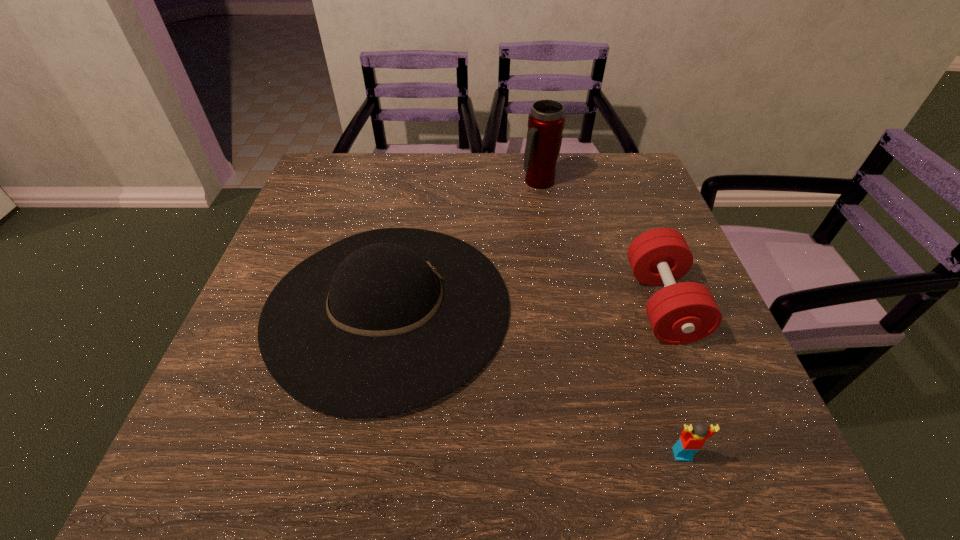
The height and width of the screenshot is (540, 960). I want to click on free location at the far right corner of the desktop, so click(x=623, y=158).

Where is `empty space between the second tallest object and the dumbbell`? The height and width of the screenshot is (540, 960). empty space between the second tallest object and the dumbbell is located at coordinates (525, 306).

The height and width of the screenshot is (540, 960). Identify the location of free point between the sombrero and the nearest object. (535, 381).

Identify the location of free space that is in between the third tallest object and the farthest object. This screenshot has height=540, width=960. (600, 243).

The width and height of the screenshot is (960, 540). I want to click on vacant space that is in between the thermos bottle and the dumbbell, so click(600, 243).

The image size is (960, 540). I want to click on vacant space in between the second tallest object and the third tallest object, so click(x=525, y=306).

Identify the location of free space between the leftmost object and the dumbbell. (525, 306).

I want to click on free spot between the Lego and the dumbbell, so click(672, 379).

The image size is (960, 540). What are the coordinates of `unoccupied area between the third tallest object and the sombrero` in the screenshot? It's located at (525, 306).

Locate an element on the screen. This screenshot has height=540, width=960. vacant point located between the third tallest object and the third object from right to left is located at coordinates (600, 243).